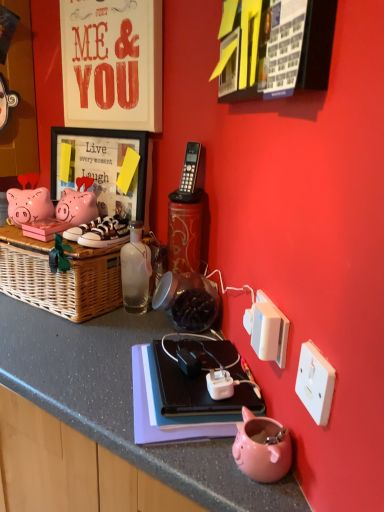
Describe the element at coordinates (105, 233) in the screenshot. Image resolution: width=384 pixels, height=512 pixels. I see `white canvas sneakers at center, acting as the first footwear starting from the right` at that location.

What is the approximate height of transparent glass bottle at center?

It is 9.23 inches.

The height and width of the screenshot is (512, 384). What do you see at coordinates (60, 277) in the screenshot?
I see `woven wood picnic basket at left` at bounding box center [60, 277].

At what (x,y) coordinates should I click in order to perform the action: click on white plastic power outlet at lower right, marked as the second power outlet in a back-to-front arrangement. Please return your answer as a coordinate pair (x, y). The height and width of the screenshot is (512, 384). Looking at the image, I should click on (315, 383).

Considering the relative sizes of matte black picture frame at upper left and white leather sneakers at left, positioned as the first footwear in left-to-right order, in the image provided, is matte black picture frame at upper left thinner than white leather sneakers at left, positioned as the first footwear in left-to-right order,?

Yes, matte black picture frame at upper left is thinner than white leather sneakers at left, positioned as the first footwear in left-to-right order.

Considering the relative positions of matte black picture frame at upper left and white leather sneakers at left, placed as the second footwear when sorted from right to left, in the image provided, is matte black picture frame at upper left to the left of white leather sneakers at left, placed as the second footwear when sorted from right to left, from the viewer's perspective?

Yes, matte black picture frame at upper left is to the left of white leather sneakers at left, placed as the second footwear when sorted from right to left.

Is matte black picture frame at upper left outside of white leather sneakers at left, positioned as the first footwear in left-to-right order?

Yes.

Is matte black picture frame at upper left with white leather sneakers at left, positioned as the first footwear in left-to-right order?

matte black picture frame at upper left is not next to white leather sneakers at left, positioned as the first footwear in left-to-right order, and they're not touching.

Is white plastic light switch at upper right at the back of woven wood picnic basket at left?

No.

How many degrees apart are the facing directions of woven wood picnic basket at left and white plastic light switch at upper right?

44.9 degrees separate the facing orientations of woven wood picnic basket at left and white plastic light switch at upper right.

Considering their positions, is woven wood picnic basket at left located in front of or behind white plastic light switch at upper right?

woven wood picnic basket at left is positioned farther from the viewer than white plastic light switch at upper right.

Considering the relative sizes of woven wood picnic basket at left and white plastic light switch at upper right in the image provided, is woven wood picnic basket at left taller than white plastic light switch at upper right?

Yes, woven wood picnic basket at left is taller than white plastic light switch at upper right.

Which object is positioned more to the left, white plastic power outlet at lower right, marked as the second power outlet in a back-to-front arrangement, or white plastic power outlet at lower right, which appears as the 2th power outlet when viewed from the right?

white plastic power outlet at lower right, which appears as the 2th power outlet when viewed from the right, is more to the left.

Is white plastic power outlet at lower right, which is counted as the 2th power outlet, starting from the left, thinner than white plastic power outlet at lower right, which appears as the 1th power outlet when viewed from the left?

Yes, white plastic power outlet at lower right, which is counted as the 2th power outlet, starting from the left, is thinner than white plastic power outlet at lower right, which appears as the 1th power outlet when viewed from the left.

The image size is (384, 512). What are the coordinates of `power outlet below the white plastic power outlet at lower right, arranged as the 1th power outlet when viewed from the front (from the image's perspective)` in the screenshot? It's located at (220, 384).

Is white plastic power outlet at lower right, which ranks as the first power outlet in back-to-front order, inside white plastic power outlet at lower right, marked as the second power outlet in a back-to-front arrangement?

Actually, white plastic power outlet at lower right, which ranks as the first power outlet in back-to-front order, is outside white plastic power outlet at lower right, marked as the second power outlet in a back-to-front arrangement.

Is pink glossy piggy bank at lower center positioned beyond the bounds of white plastic power outlet at lower right, which is counted as the 2th power outlet, starting from the front?

Absolutely, pink glossy piggy bank at lower center is external to white plastic power outlet at lower right, which is counted as the 2th power outlet, starting from the front.

Which object is positioned more to the right, pink glossy piggy bank at lower center or white plastic power outlet at lower right, which ranks as the first power outlet in back-to-front order?

pink glossy piggy bank at lower center is more to the right.

Between pink glossy piggy bank at lower center and white plastic power outlet at lower right, which ranks as the first power outlet in back-to-front order, which one is positioned behind?

white plastic power outlet at lower right, which ranks as the first power outlet in back-to-front order, is more distant.

From the image's perspective, which one is positioned lower, white canvas sneakers at center, which ranks as the 2th footwear in left-to-right order, or white plastic light switch at upper right?

white plastic light switch at upper right appears lower in the image.

Consider the image. Does white canvas sneakers at center, acting as the first footwear starting from the right, have a lesser width compared to white plastic light switch at upper right?

Incorrect, the width of white canvas sneakers at center, acting as the first footwear starting from the right, is not less than that of white plastic light switch at upper right.

Which point is more forward, (116, 222) or (254, 334)?

The point (254, 334) is more forward.

Between white plastic light switch at upper right and white plastic power plugs and sockets at right, which one has larger size?

With larger size is white plastic power plugs and sockets at right.

Is white plastic light switch at upper right positioned beyond the bounds of white plastic power plugs and sockets at right?

Indeed, white plastic light switch at upper right is completely outside white plastic power plugs and sockets at right.

Can you confirm if white plastic light switch at upper right is shorter than white plastic power plugs and sockets at right?

Correct, white plastic light switch at upper right is not as tall as white plastic power plugs and sockets at right.

From a real-world perspective, is white plastic light switch at upper right beneath pink glossy piggy bank at lower center?

No, from a real-world perspective, white plastic light switch at upper right is not under pink glossy piggy bank at lower center.

Who is shorter, white plastic light switch at upper right or pink glossy piggy bank at lower center?

With less height is pink glossy piggy bank at lower center.

Who is smaller, white plastic light switch at upper right or pink glossy piggy bank at lower center?

white plastic light switch at upper right.

Between point (278, 345) and point (267, 443), which one is positioned behind?

The point (278, 345) is farther from the camera.

From the image's perspective, count 1st footwears downward from the matte black picture frame at upper left and point to it. Please provide its 2D coordinates.

[(86, 227)]

Locate an element on the screen. light switch in front of the woven wood picnic basket at left is located at coordinates (265, 331).

Estimate the real-world distances between objects in this image. Which object is further from white plastic power outlet at lower right, which appears as the 2th power outlet when viewed from the right, white plastic power plugs and sockets at right or white plastic power outlet at lower right, the first power outlet when ordered from right to left?

white plastic power outlet at lower right, the first power outlet when ordered from right to left, lies further to white plastic power outlet at lower right, which appears as the 2th power outlet when viewed from the right, than the other object.

Based on their spatial positions, is matte pink piggy bank at left or white plastic power outlet at lower right, the first power outlet when ordered from right to left, closer to pink glossy piggy bank at lower center?

white plastic power outlet at lower right, the first power outlet when ordered from right to left, lies closer to pink glossy piggy bank at lower center than the other object.

Looking at the image, which one is located further to transparent glass bottle at center, white plastic light switch at upper right or pink glossy piggy bank at lower center?

pink glossy piggy bank at lower center is further to transparent glass bottle at center.

Looking at this image, looking at the image, which one is located further to white plastic power outlet at lower right, the first power outlet when ordered from right to left, white leather sneakers at left, placed as the second footwear when sorted from right to left, or matte black picture frame at upper left?

matte black picture frame at upper left is further to white plastic power outlet at lower right, the first power outlet when ordered from right to left.

Considering their positions, is matte black picture frame at upper left positioned further to white plastic power plugs and sockets at right than white canvas sneakers at center, which ranks as the 2th footwear in left-to-right order?

matte black picture frame at upper left is further to white plastic power plugs and sockets at right.

When comparing their distances from white plastic light switch at upper right, does white canvas sneakers at center, which ranks as the 2th footwear in left-to-right order, or white leather sneakers at left, positioned as the first footwear in left-to-right order, seem closer?

Based on the image, white canvas sneakers at center, which ranks as the 2th footwear in left-to-right order, appears to be nearer to white plastic light switch at upper right.

Considering their positions, is white plastic power plugs and sockets at right positioned further to white leather sneakers at left, placed as the second footwear when sorted from right to left, than white plastic light switch at upper right?

The object further to white leather sneakers at left, placed as the second footwear when sorted from right to left, is white plastic light switch at upper right.

Based on their spatial positions, is transparent glass bottle at center or white leather sneakers at left, placed as the second footwear when sorted from right to left, further from white plastic light switch at upper right?

white leather sneakers at left, placed as the second footwear when sorted from right to left, is further to white plastic light switch at upper right.

You are a GUI agent. You are given a task and a screenshot of the screen. Output one action in this format:
    pyautogui.click(x=<x>, y=<y>)
    Task: Click on the power outlet positioned between white plastic light switch at upper right and transparent glass bottle at center from near to far
    The height and width of the screenshot is (512, 384).
    Given the screenshot: What is the action you would take?
    pyautogui.click(x=220, y=384)

I want to click on power plugs and sockets positioned between white plastic light switch at upper right and transparent glass bottle at center from near to far, so click(x=267, y=330).

Find the location of `power plugs and sockets situated between woven wood picnic basket at left and white plastic power outlet at lower right, which is counted as the 2th power outlet, starting from the left, from left to right`. power plugs and sockets situated between woven wood picnic basket at left and white plastic power outlet at lower right, which is counted as the 2th power outlet, starting from the left, from left to right is located at coordinates click(x=267, y=330).

Locate an element on the screen. This screenshot has width=384, height=512. picture frame located between matte pink piggy bank at left and transparent glass bottle at center in the left-right direction is located at coordinates (101, 168).